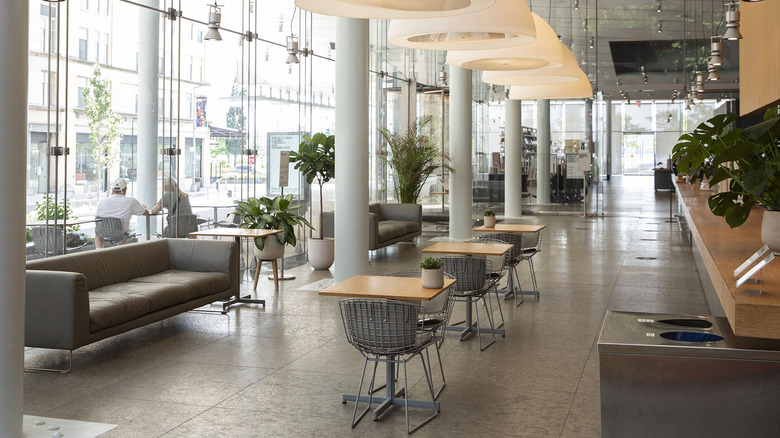
This screenshot has width=780, height=438. Find the location of `dining chair`. dining chair is located at coordinates (380, 331), (430, 307), (466, 284), (513, 242), (532, 237), (491, 267).